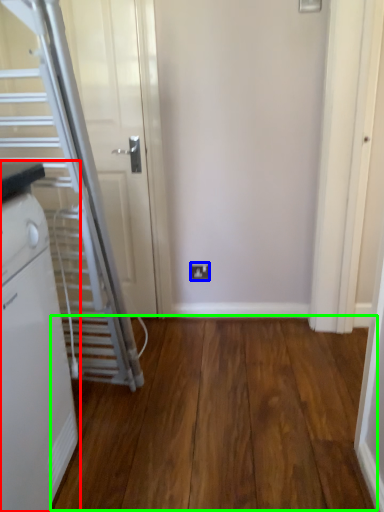
Question: Considering the real-world distances, which object is farthest from home appliance (highlighted by a red box)? electric outlet (highlighted by a blue box) or hardwood (highlighted by a green box)?

Choices:
 (A) electric outlet
 (B) hardwood

Answer: (A)